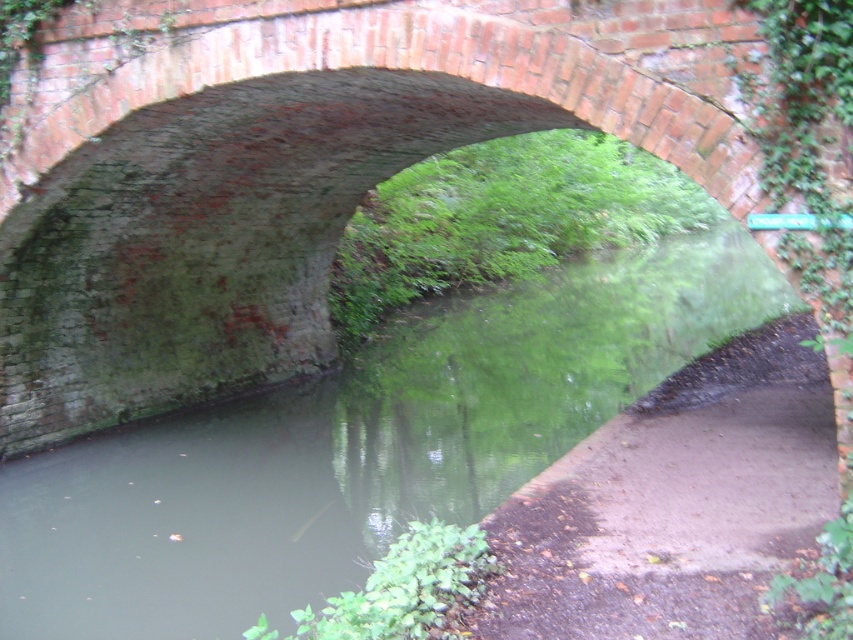
You are standing on the brick arch bridge and looking towards the water. There are two points marked on the bridge surface. The first point is at coordinates point (347, 88) and the second at point (285, 525). Which point is closer to you as you face the water?

Point (347, 88) is in front of point (285, 525), so the first point is closer to you.